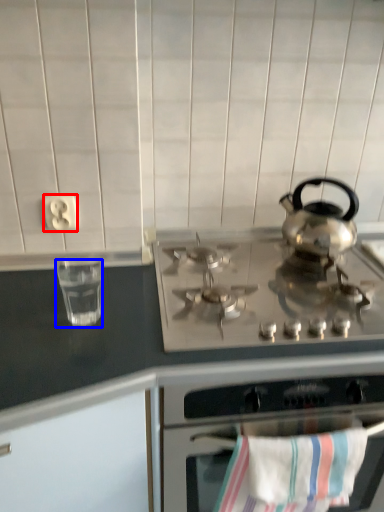
Question: Which object is further to the camera taking this photo, electric outlet (highlighted by a red box) or appliance (highlighted by a blue box)?

Choices:
 (A) electric outlet
 (B) appliance

Answer: (A)